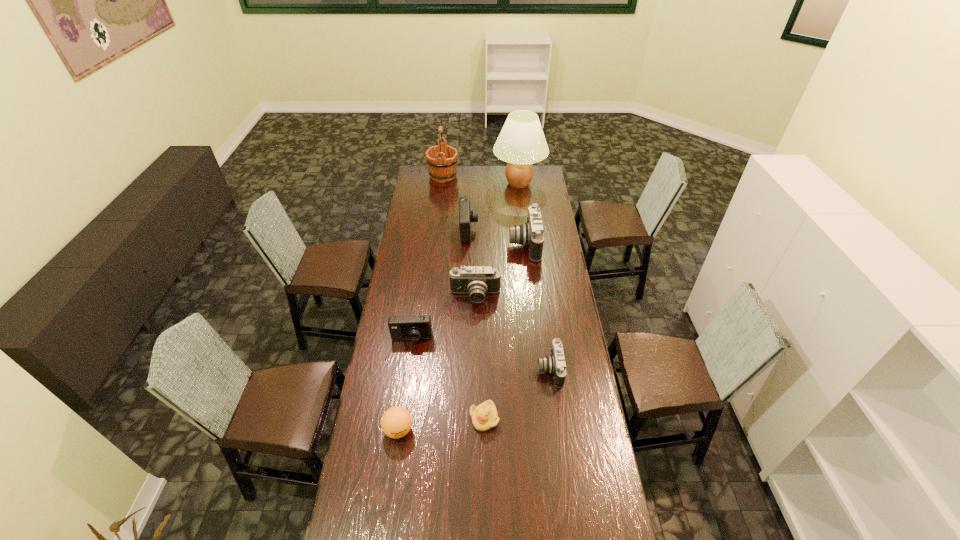
You are a GUI agent. You are given a task and a screenshot of the screen. Output one action in this format:
    pyautogui.click(x=<x>, y=<y>)
    Task: Click on the vacant area situated 0.090m on the front-facing side of the farthest black camera
    The height and width of the screenshot is (540, 960).
    Given the screenshot: What is the action you would take?
    492,244

You are a GUI agent. You are given a task and a screenshot of the screen. Output one action in this format:
    pyautogui.click(x=<x>, y=<y>)
    Task: Click on the free space located on the front-facing side of the farthest black camera
    Image resolution: width=960 pixels, height=540 pixels.
    Given the screenshot: What is the action you would take?
    pyautogui.click(x=444, y=244)

Locate an element on the screen. This screenshot has width=960, height=540. vacant area located 0.080m on the front-facing side of the farther blue camera is located at coordinates (492, 231).

Find the location of a particular element. This screenshot has width=960, height=540. vacant space situated 0.400m on the front-facing side of the third nearest camera is located at coordinates (474, 381).

Where is `vacant area situated on the front-facing side of the fourth farthest camera`? The height and width of the screenshot is (540, 960). vacant area situated on the front-facing side of the fourth farthest camera is located at coordinates tap(401, 413).

Identify the location of vacant space located on the front-facing side of the nearest black camera. The image size is (960, 540). (516, 369).

Locate an element on the screen. This screenshot has height=540, width=960. vacant area situated 0.300m on the front-facing side of the nearest black camera is located at coordinates pos(464,369).

This screenshot has height=540, width=960. What are the coordinates of `vacant area located 0.400m on the front-facing side of the nearest black camera` in the screenshot? It's located at (440, 369).

At what (x,y) coordinates should I click in order to perform the action: click on free location located on the side with brand of the ping-pong ball. Please return your answer as a coordinate pair (x, y). The width and height of the screenshot is (960, 540). Looking at the image, I should click on (387, 510).

At what (x,y) coordinates should I click in order to perform the action: click on free space located 0.130m on the front-facing side of the shortest object. Please return your answer as a coordinate pair (x, y). Looking at the image, I should click on (485, 468).